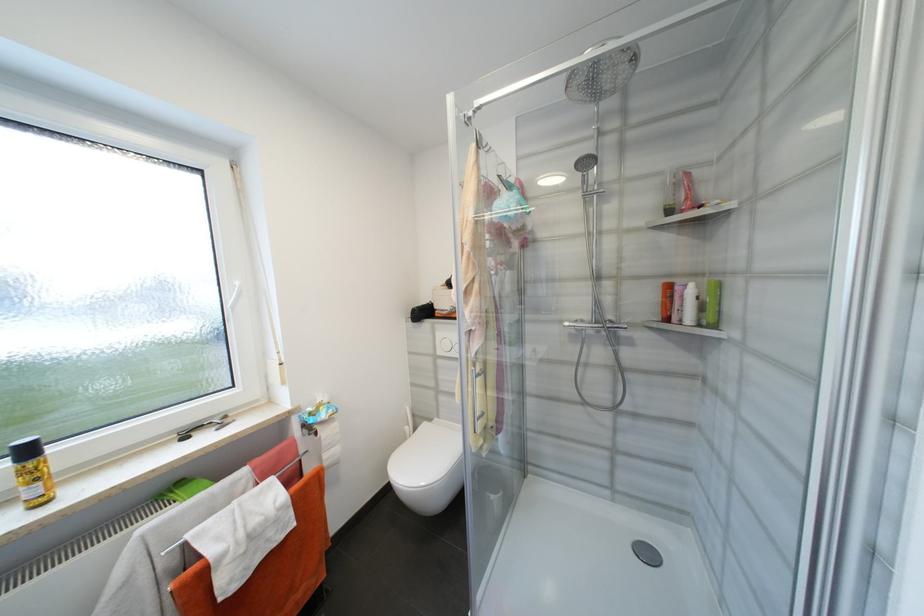
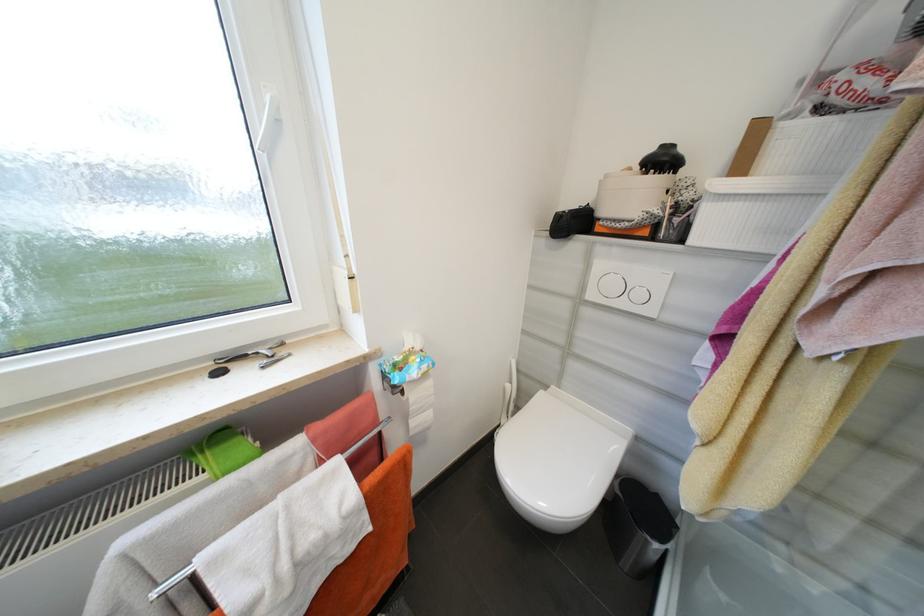
The point at (419, 312) is marked in the first image. Where is the corresponding point in the second image?

(565, 217)